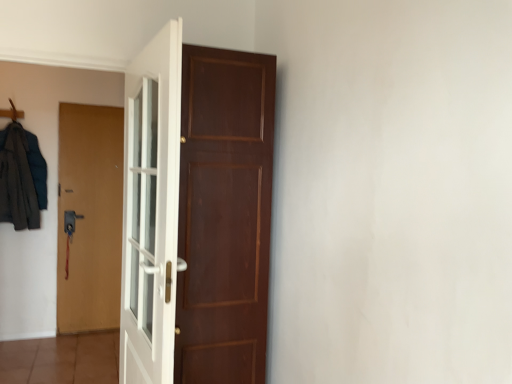
Where is `empty space that is ontop of brown matte door at left, which is the 1th door from back to front (from a real-world perspective)`? The width and height of the screenshot is (512, 384). empty space that is ontop of brown matte door at left, which is the 1th door from back to front (from a real-world perspective) is located at coordinates (91, 107).